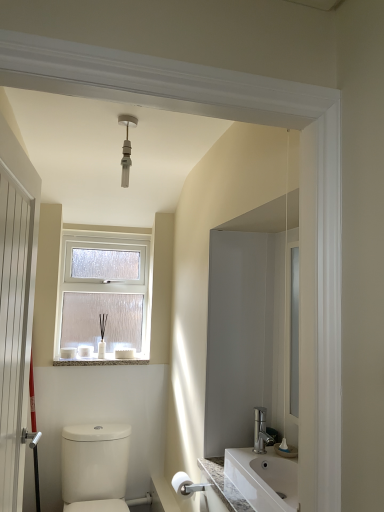
Question: From a real-world perspective, is white marble window sill at lower center over white wooden door at left?

Choices:
 (A) no
 (B) yes

Answer: (A)

Question: From the image's perspective, is white marble window sill at lower center over white wooden door at left?

Choices:
 (A) no
 (B) yes

Answer: (A)

Question: Is white marble window sill at lower center outside white wooden door at left?

Choices:
 (A) no
 (B) yes

Answer: (B)

Question: Is white marble window sill at lower center positioned far away from white wooden door at left?

Choices:
 (A) yes
 (B) no

Answer: (A)

Question: Does white marble window sill at lower center have a lesser height compared to white wooden door at left?

Choices:
 (A) no
 (B) yes

Answer: (B)

Question: Considering the positions of white frosted glass window at upper center and white glossy toilet at lower left in the image, is white frosted glass window at upper center taller or shorter than white glossy toilet at lower left?

Choices:
 (A) short
 (B) tall

Answer: (B)

Question: Considering the positions of white frosted glass window at upper center and white glossy toilet at lower left in the image, is white frosted glass window at upper center bigger or smaller than white glossy toilet at lower left?

Choices:
 (A) big
 (B) small

Answer: (B)

Question: Do you think white frosted glass window at upper center is within white glossy toilet at lower left, or outside of it?

Choices:
 (A) inside
 (B) outside

Answer: (B)

Question: Looking at their shapes, would you say white frosted glass window at upper center is wider or thinner than white glossy toilet at lower left?

Choices:
 (A) thin
 (B) wide

Answer: (A)

Question: Is white plastic light fixture at upper center inside or outside of white glossy toilet at lower left?

Choices:
 (A) outside
 (B) inside

Answer: (A)

Question: Looking at their shapes, would you say white plastic light fixture at upper center is wider or thinner than white glossy toilet at lower left?

Choices:
 (A) thin
 (B) wide

Answer: (A)

Question: From a real-world perspective, is white plastic light fixture at upper center physically located above or below white glossy toilet at lower left?

Choices:
 (A) below
 (B) above

Answer: (B)

Question: Would you say white plastic light fixture at upper center is to the left or to the right of white glossy toilet at lower left in the picture?

Choices:
 (A) right
 (B) left

Answer: (A)

Question: Does point (94, 502) appear closer or farther from the camera than point (125, 144)?

Choices:
 (A) closer
 (B) farther

Answer: (B)

Question: From the image's perspective, relative to white plastic light fixture at upper center, is white glossy toilet at lower left above or below?

Choices:
 (A) below
 (B) above

Answer: (A)